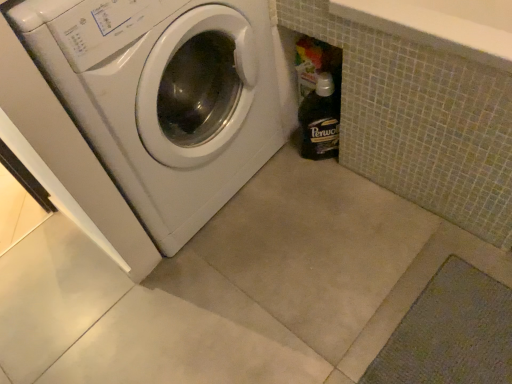
I want to click on free space on the front side of white glossy washing machine at left, so click(x=220, y=294).